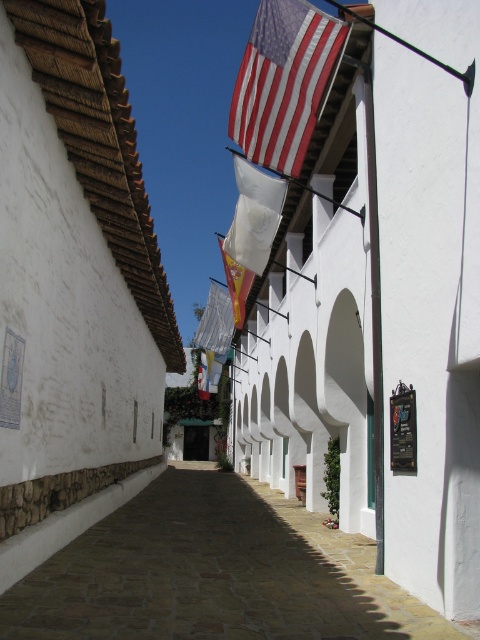
Question: Does red-white striped fabric flag at upper center have a smaller size compared to yellow fabric flag at center?

Choices:
 (A) no
 (B) yes

Answer: (B)

Question: Which point is closer to the camera?

Choices:
 (A) (261, 177)
 (B) (282, 563)
 (C) (250, 131)

Answer: (B)

Question: Which object appears farthest from the camera in this image?

Choices:
 (A) white fabric flag at center
 (B) brown stone alley at center

Answer: (A)

Question: Can you confirm if brown stone alley at center is positioned to the right of red-white striped fabric flag at upper center?

Choices:
 (A) yes
 (B) no

Answer: (B)

Question: Does brown stone alley at center have a lesser width compared to red-white striped fabric flag at upper center?

Choices:
 (A) no
 (B) yes

Answer: (A)

Question: Which point is closer to the camera?

Choices:
 (A) (249, 266)
 (B) (243, 291)
 (C) (292, 17)

Answer: (C)